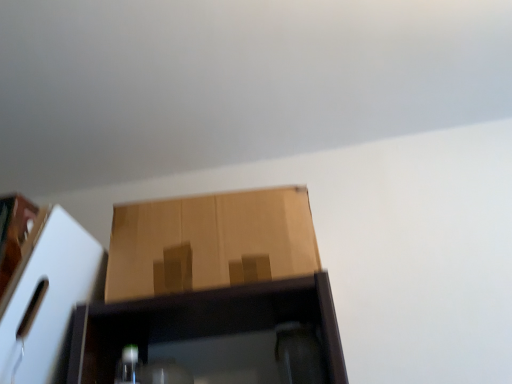
Question: Should I look upward or downward to see brown cardboard box at center, which appears as the second cardboard box when viewed from the left?

Choices:
 (A) up
 (B) down

Answer: (B)

Question: Should I look upward or downward to see matte brown cardboard box at left, arranged as the first cardboard box when viewed from the left?

Choices:
 (A) up
 (B) down

Answer: (B)

Question: Can you see brown cardboard box at center, positioned as the 1th cardboard box in right-to-left order, touching matte brown cardboard box at left, the 2th cardboard box viewed from the right?

Choices:
 (A) yes
 (B) no

Answer: (B)

Question: Is matte brown cardboard box at left, arranged as the first cardboard box when viewed from the left, located within brown cardboard box at center, which appears as the second cardboard box when viewed from the left?

Choices:
 (A) yes
 (B) no

Answer: (B)

Question: From a real-world perspective, is brown cardboard box at center, positioned as the 1th cardboard box in right-to-left order, on matte brown cardboard box at left, arranged as the first cardboard box when viewed from the left?

Choices:
 (A) no
 (B) yes

Answer: (B)

Question: Is brown cardboard box at center, which appears as the second cardboard box when viewed from the left, smaller than matte brown cardboard box at left, arranged as the first cardboard box when viewed from the left?

Choices:
 (A) no
 (B) yes

Answer: (A)

Question: Is brown cardboard box at center, which appears as the second cardboard box when viewed from the left, at the right side of matte brown cardboard box at left, the 2th cardboard box viewed from the right?

Choices:
 (A) no
 (B) yes

Answer: (B)

Question: Considering the relative sizes of brown cardboard box at center, which appears as the second cardboard box when viewed from the left, and matte brown cardboard box at left, arranged as the first cardboard box when viewed from the left, in the image provided, is brown cardboard box at center, which appears as the second cardboard box when viewed from the left, wider than matte brown cardboard box at left, arranged as the first cardboard box when viewed from the left,?

Choices:
 (A) no
 (B) yes

Answer: (A)

Question: Is matte brown cardboard box at left, the 2th cardboard box viewed from the right, positioned beyond the bounds of brown cardboard box at center, positioned as the 1th cardboard box in right-to-left order?

Choices:
 (A) no
 (B) yes

Answer: (B)

Question: Considering the relative positions of matte brown cardboard box at left, the 2th cardboard box viewed from the right, and brown cardboard box at center, which appears as the second cardboard box when viewed from the left, in the image provided, is matte brown cardboard box at left, the 2th cardboard box viewed from the right, to the left of brown cardboard box at center, which appears as the second cardboard box when viewed from the left, from the viewer's perspective?

Choices:
 (A) no
 (B) yes

Answer: (B)

Question: From the image's perspective, does matte brown cardboard box at left, arranged as the first cardboard box when viewed from the left, appear lower than brown cardboard box at center, positioned as the 1th cardboard box in right-to-left order?

Choices:
 (A) yes
 (B) no

Answer: (A)

Question: Is matte brown cardboard box at left, arranged as the first cardboard box when viewed from the left, wider than brown cardboard box at center, which appears as the second cardboard box when viewed from the left?

Choices:
 (A) yes
 (B) no

Answer: (A)

Question: From the image's perspective, is matte brown cardboard box at left, the 2th cardboard box viewed from the right, on top of brown cardboard box at center, which appears as the second cardboard box when viewed from the left?

Choices:
 (A) yes
 (B) no

Answer: (B)

Question: Are matte brown cardboard box at left, the 2th cardboard box viewed from the right, and brown cardboard box at center, positioned as the 1th cardboard box in right-to-left order, located far from each other?

Choices:
 (A) no
 (B) yes

Answer: (A)

Question: From their relative heights in the image, would you say brown cardboard box at center, which appears as the second cardboard box when viewed from the left, is taller or shorter than matte brown cardboard box at left, arranged as the first cardboard box when viewed from the left?

Choices:
 (A) short
 (B) tall

Answer: (A)